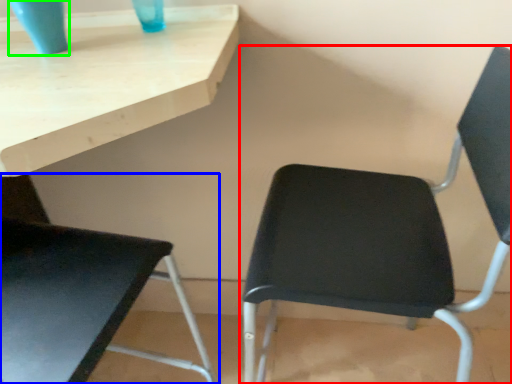
Question: Which object is positioned closest to chair (highlighted by a red box)? Select from chair (highlighted by a blue box) and glass vase (highlighted by a green box).

Choices:
 (A) chair
 (B) glass vase

Answer: (A)